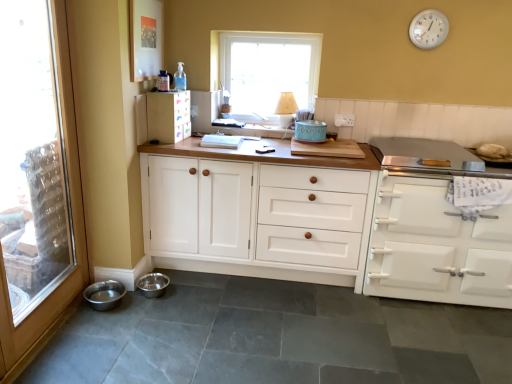
Question: From the image's perspective, is matte white cabinet at upper left, the first cabinetry in the left-to-right sequence, over white wood cabinet at center, acting as the 2th cabinetry starting from the left?

Choices:
 (A) no
 (B) yes

Answer: (B)

Question: Is matte white cabinet at upper left, the first cabinetry in the left-to-right sequence, bigger than white wood cabinet at center, the second cabinetry in the right-to-left sequence?

Choices:
 (A) yes
 (B) no

Answer: (B)

Question: Is matte white cabinet at upper left, positioned as the third cabinetry in right-to-left order, directly adjacent to white wood cabinet at center, acting as the 2th cabinetry starting from the left?

Choices:
 (A) no
 (B) yes

Answer: (A)

Question: From a real-world perspective, is matte white cabinet at upper left, positioned as the third cabinetry in right-to-left order, positioned over white wood cabinet at center, the second cabinetry in the right-to-left sequence, based on gravity?

Choices:
 (A) yes
 (B) no

Answer: (A)

Question: Is matte white cabinet at upper left, the first cabinetry in the left-to-right sequence, far from white wood cabinet at center, the second cabinetry in the right-to-left sequence?

Choices:
 (A) no
 (B) yes

Answer: (A)

Question: Is matte white cabinet at upper left, positioned as the third cabinetry in right-to-left order, positioned beyond the bounds of white wood cabinet at center, acting as the 2th cabinetry starting from the left?

Choices:
 (A) no
 (B) yes

Answer: (B)

Question: Would you consider white frame window at upper center to be distant from white plastic clock at upper right?

Choices:
 (A) yes
 (B) no

Answer: (B)

Question: From a real-world perspective, is white frame window at upper center over white plastic clock at upper right?

Choices:
 (A) no
 (B) yes

Answer: (A)

Question: Can you confirm if white frame window at upper center is wider than white plastic clock at upper right?

Choices:
 (A) yes
 (B) no

Answer: (A)

Question: Is white frame window at upper center at the left side of white plastic clock at upper right?

Choices:
 (A) no
 (B) yes

Answer: (B)

Question: Does white frame window at upper center have a lesser width compared to white plastic clock at upper right?

Choices:
 (A) no
 (B) yes

Answer: (A)

Question: Considering the relative sizes of white frame window at upper center and white plastic clock at upper right in the image provided, is white frame window at upper center smaller than white plastic clock at upper right?

Choices:
 (A) no
 (B) yes

Answer: (A)

Question: From a real-world perspective, is matte white cabinet at upper left, positioned as the third cabinetry in right-to-left order, on top of white plastic clock at upper right?

Choices:
 (A) yes
 (B) no

Answer: (B)